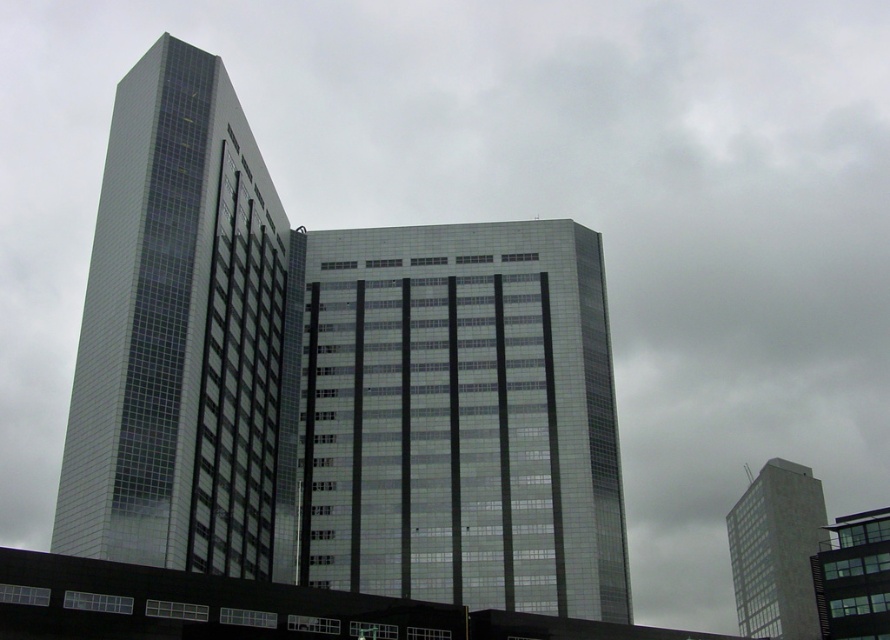
Question: Is smooth concrete tower at right thinner than glassy reflective building at lower right?

Choices:
 (A) yes
 (B) no

Answer: (A)

Question: Which of the following is the closest to the observer?

Choices:
 (A) glassy reflective building at center
 (B) glassy reflective tower at left

Answer: (B)

Question: Estimate the real-world distances between objects in this image. Which object is farther from the glassy reflective building at lower right?

Choices:
 (A) glassy reflective building at center
 (B) glassy reflective tower at left
 (C) smooth concrete tower at right

Answer: (B)

Question: Is glassy reflective building at center positioned behind smooth concrete tower at right?

Choices:
 (A) yes
 (B) no

Answer: (B)

Question: Which point is farther to the camera?

Choices:
 (A) glassy reflective building at center
 (B) smooth concrete tower at right

Answer: (B)

Question: Does glassy reflective building at center come behind glassy reflective tower at left?

Choices:
 (A) yes
 (B) no

Answer: (A)